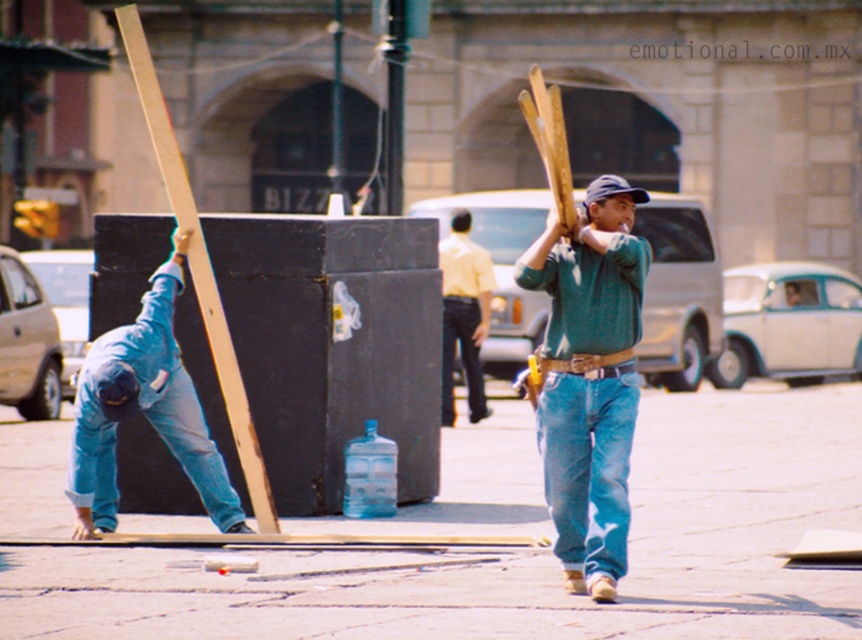
You are standing on the street looking at the scene. You see the blue denim jeans at lower left and the yellow shirt at center. Which one is positioned more to the left side of the scene?

The blue denim jeans at lower left are positioned more to the left side of the scene than the yellow shirt at center.

You are standing at the origin point of the coordinate system in this street scene. The blue denim jeans at lower left is located at a specific coordinate. Can you tell me what coordinate it is?

The blue denim jeans at lower left is located at point (142,410).